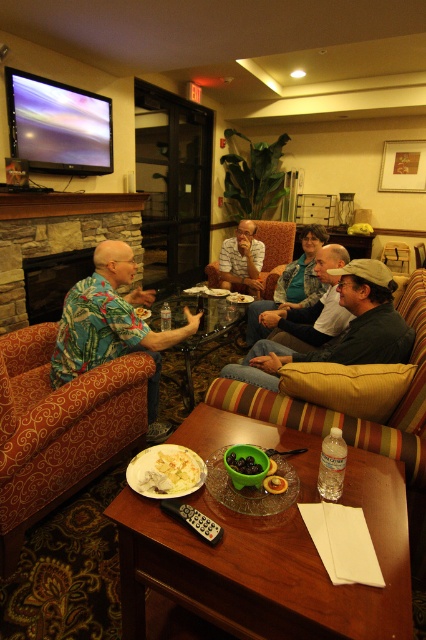
Question: Among these objects, which one is nearest to the camera?

Choices:
 (A) white creamy sauce at center
 (B) smooth plastic remote at center
 (C) golden brown pastry at center

Answer: (C)

Question: Which point is closer to the camera?

Choices:
 (A) smooth green bowl at center
 (B) golden brown pastry at center
 (C) striped shirt at center

Answer: (B)

Question: Can you confirm if smooth plastic remote at center is positioned to the right of matte floral shirt at upper left?

Choices:
 (A) yes
 (B) no

Answer: (A)

Question: Considering the real-world distances, which object is closest to the smooth green bowl at center?

Choices:
 (A) matte khaki cap at center
 (B) white creamy sauce at center
 (C) striped shirt at center
 (D) wooden armchair at center

Answer: (B)

Question: Is white creamy sauce at center wider than wooden armchair at center?

Choices:
 (A) yes
 (B) no

Answer: (B)

Question: Does golden brown pastry at center appear on the right side of smooth plastic remote at center?

Choices:
 (A) no
 (B) yes

Answer: (A)